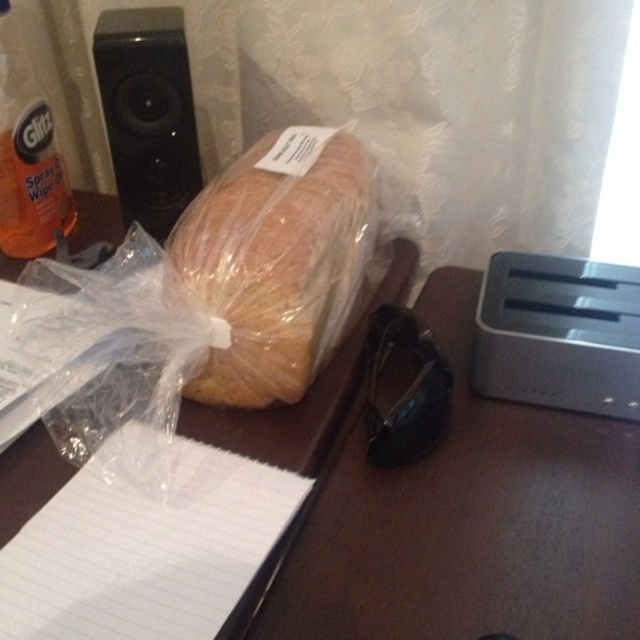
Looking at this image, you are an office assistant who needs to locate the white lined paper at lower left on the desk. According to the coordinates provided, where exactly should you look on the desk?

The white lined paper at lower left is located at the 2D coordinates point (x=147, y=552) on the desk.

You are organizing items on a desk and need to place the clear plastic bread at center and orange matte spray wipes at left into a drawer. The drawer has a width of 15 cm. Can both items fit side by side if placed horizontally?

The clear plastic bread at center has a larger width than the orange matte spray wipes at left. Since the drawer is only 15 cm wide, it is uncertain if both items can fit side by side without overlapping unless the combined width of both items is less than or equal to 15 cm. However, the exact widths are not provided, so we cannot confirm for sure.